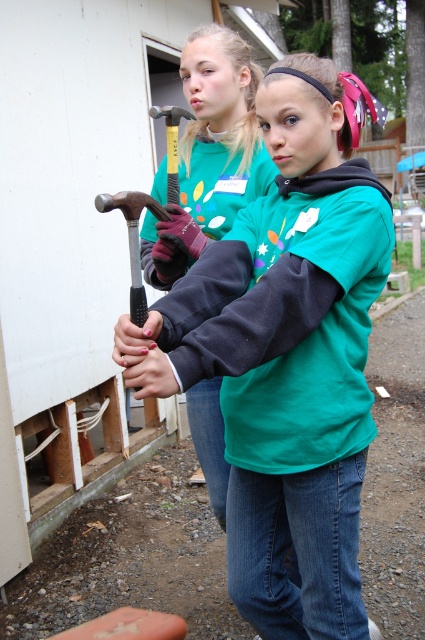
Can you confirm if green matte sweatshirt at center is shorter than matte black hammer at upper left?

No.

Does green matte sweatshirt at center have a greater height compared to matte black hammer at upper left?

Correct, green matte sweatshirt at center is much taller as matte black hammer at upper left.

Is point (354, 580) closer to viewer compared to point (223, 484)?

Yes, point (354, 580) is closer to viewer.

Find the location of `green matte sweatshirt at center`. green matte sweatshirt at center is located at coordinates (x=286, y=356).